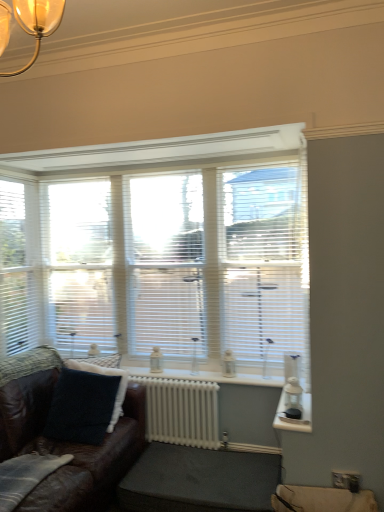
Question: From the image's perspective, is transparent plastic glass door at center beneath white painted metal radiator at center?

Choices:
 (A) no
 (B) yes

Answer: (A)

Question: From a real-world perspective, is transparent plastic glass door at center on white painted metal radiator at center?

Choices:
 (A) yes
 (B) no

Answer: (A)

Question: Can you confirm if transparent plastic glass door at center is wider than white painted metal radiator at center?

Choices:
 (A) no
 (B) yes

Answer: (A)

Question: Is the surface of transparent plastic glass door at center in direct contact with white painted metal radiator at center?

Choices:
 (A) yes
 (B) no

Answer: (B)

Question: Does transparent plastic glass door at center have a smaller size compared to white painted metal radiator at center?

Choices:
 (A) yes
 (B) no

Answer: (B)

Question: In the image, is brown leather couch at lower left on the left side or the right side of white blinds at center?

Choices:
 (A) right
 (B) left

Answer: (B)

Question: Looking at their shapes, would you say brown leather couch at lower left is wider or thinner than white blinds at center?

Choices:
 (A) wide
 (B) thin

Answer: (A)

Question: Is brown leather couch at lower left situated inside white blinds at center or outside?

Choices:
 (A) inside
 (B) outside

Answer: (B)

Question: Is brown leather couch at lower left in front of or behind white blinds at center in the image?

Choices:
 (A) front
 (B) behind

Answer: (A)

Question: Relative to white painted metal radiator at center, is white blinds at center in front or behind?

Choices:
 (A) front
 (B) behind

Answer: (B)

Question: Do you think white blinds at center is within white painted metal radiator at center, or outside of it?

Choices:
 (A) inside
 (B) outside

Answer: (B)

Question: Does point (66, 216) appear closer or farther from the camera than point (167, 403)?

Choices:
 (A) closer
 (B) farther

Answer: (B)

Question: In terms of height, does white blinds at center look taller or shorter compared to white painted metal radiator at center?

Choices:
 (A) short
 (B) tall

Answer: (B)

Question: Relative to brown leather couch at lower left, is dark gray fabric footrest at lower center in front or behind?

Choices:
 (A) front
 (B) behind

Answer: (B)

Question: Is point (147, 446) positioned closer to the camera than point (112, 488)?

Choices:
 (A) closer
 (B) farther

Answer: (B)